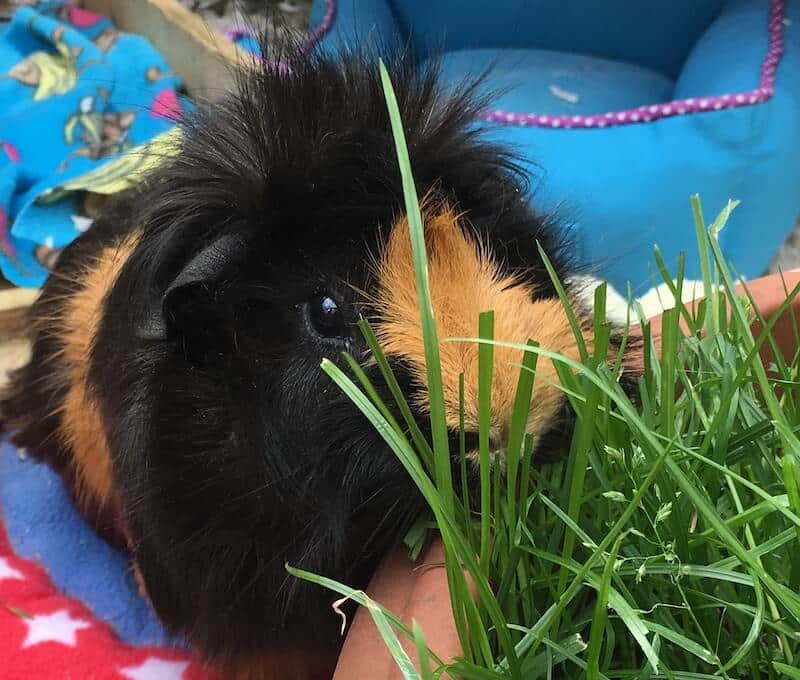
This screenshot has width=800, height=680. I want to click on bedding, so click(x=102, y=105), click(x=77, y=596).